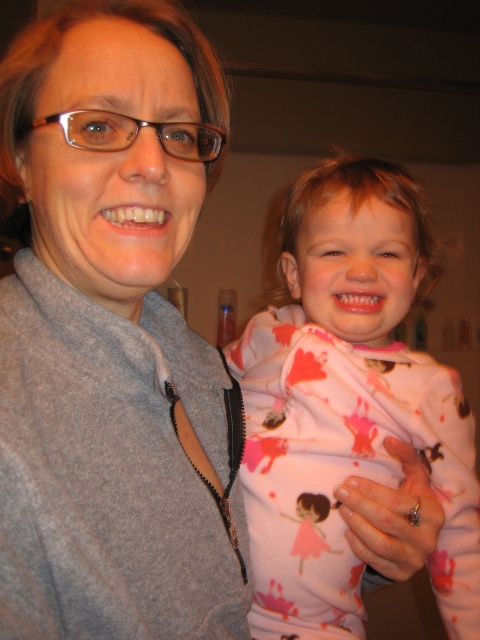
Which is below, gray fleece jacket at left or pink fleece pajamas at right?

pink fleece pajamas at right is lower down.

Between gray fleece jacket at left and pink fleece pajamas at right, which one has less height?

gray fleece jacket at left

Is point (127, 188) positioned behind point (336, 170)?

That is False.

You are a GUI agent. You are given a task and a screenshot of the screen. Output one action in this format:
    pyautogui.click(x=<x>, y=<y>)
    Task: Click on the gray fleece jacket at left
    The height and width of the screenshot is (640, 480).
    Given the screenshot: What is the action you would take?
    pyautogui.click(x=112, y=337)